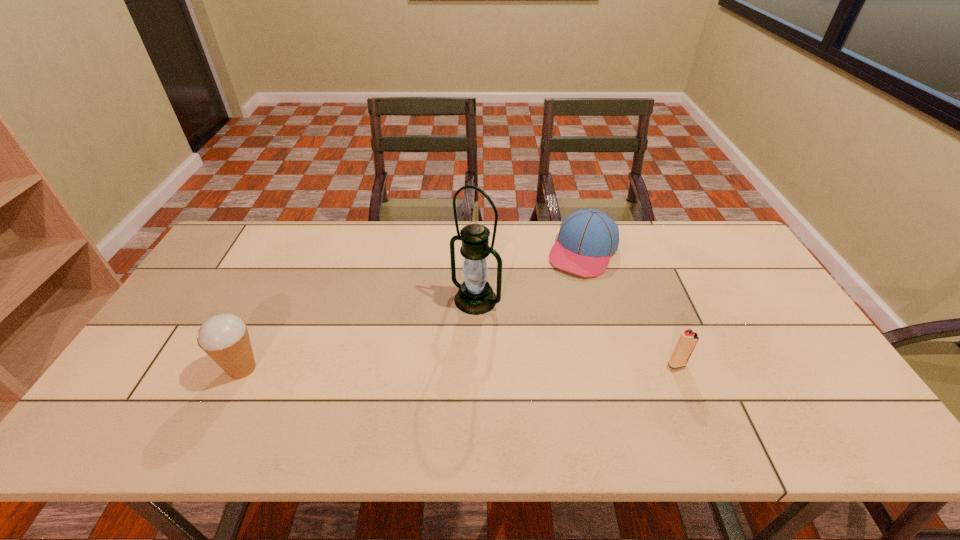
Where is `blank region between the leftmost object and the farthest object`? The width and height of the screenshot is (960, 540). blank region between the leftmost object and the farthest object is located at coordinates (413, 310).

Identify which object is the second nearest to the second object from right to left. Please provide its 2D coordinates. Your answer should be formatted as a tuple, i.e. [(x, y)], where the tuple contains the x and y coordinates of a point satisfying the conditions above.

[(688, 339)]

Where is `the second closest object to the rightmost object`? the second closest object to the rightmost object is located at coordinates (475, 296).